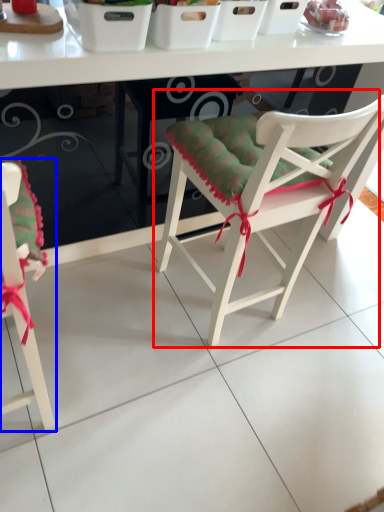
Question: Which object is further to the camera taking this photo, chair (highlighted by a red box) or chair (highlighted by a blue box)?

Choices:
 (A) chair
 (B) chair

Answer: (A)